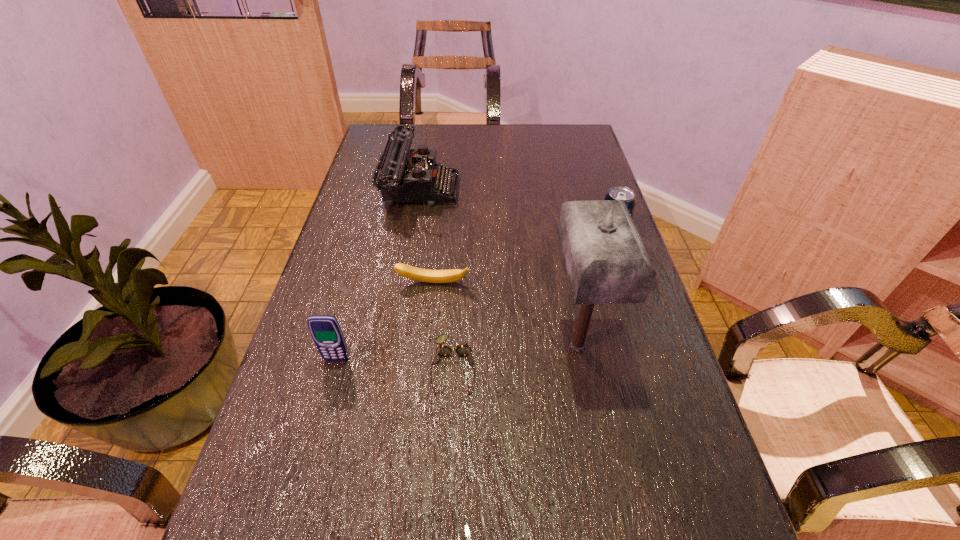
Where is `free region that satisfies the following two spatial constraints: 1. at the stem of the tallest object; 2. on the left side of the banana`? The height and width of the screenshot is (540, 960). free region that satisfies the following two spatial constraints: 1. at the stem of the tallest object; 2. on the left side of the banana is located at coordinates (x=426, y=346).